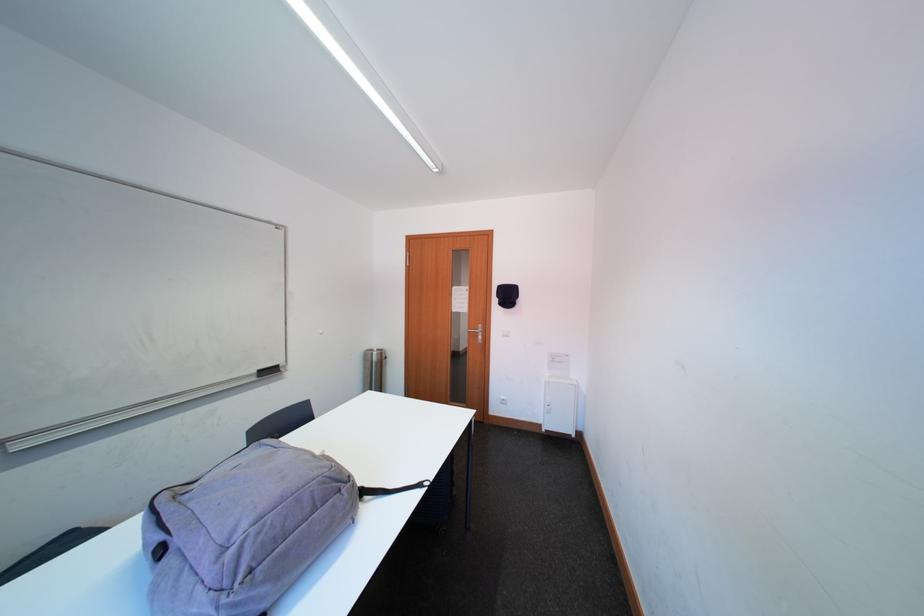
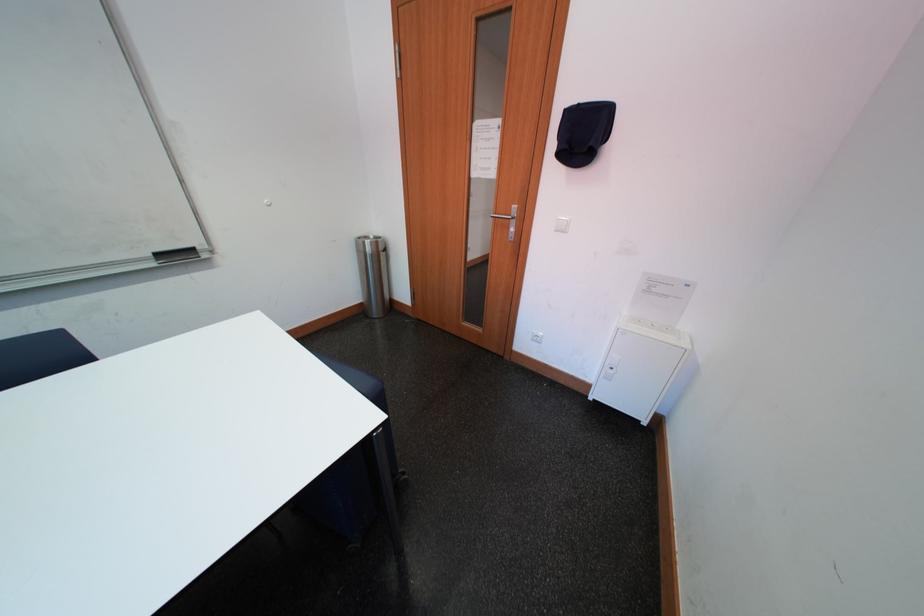
In the second image, find the point that corresponds to (x=269, y=375) in the first image.

(167, 257)